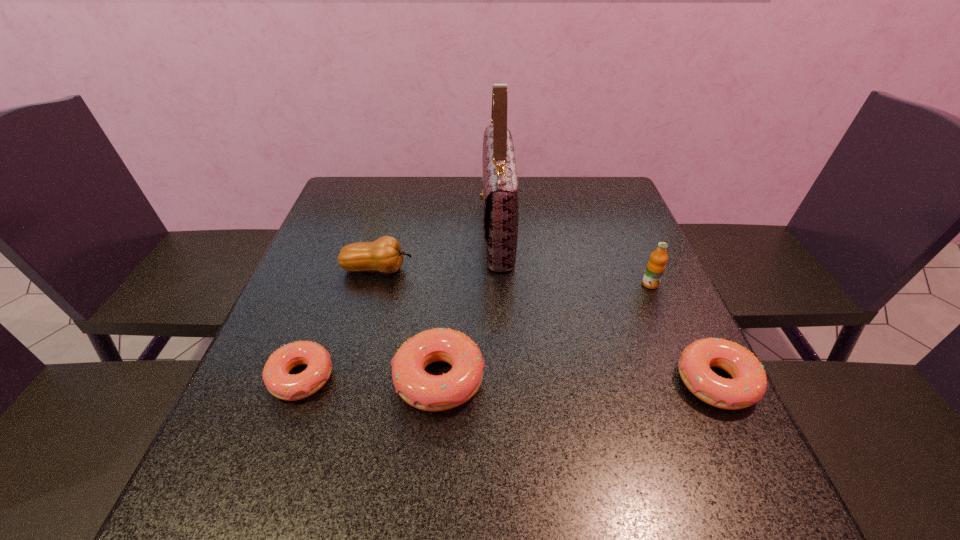
This screenshot has width=960, height=540. Find the location of `blank region between the third tallest object and the second doughnut from left to right`. blank region between the third tallest object and the second doughnut from left to right is located at coordinates (408, 324).

Where is `free spot between the tallest object and the second doughnut from right to left`? The image size is (960, 540). free spot between the tallest object and the second doughnut from right to left is located at coordinates (468, 305).

Locate an element on the screen. This screenshot has width=960, height=540. vacant area that lies between the handbag and the rightmost doughnut is located at coordinates (607, 306).

This screenshot has height=540, width=960. I want to click on free space between the third tallest object and the tallest object, so click(x=438, y=249).

At what (x,y) coordinates should I click in order to perform the action: click on free area in between the orange juice and the handbag. Please return your answer as a coordinate pair (x, y). Looking at the image, I should click on (574, 257).

You are a GUI agent. You are given a task and a screenshot of the screen. Output one action in this format:
    pyautogui.click(x=<x>, y=<y>)
    Task: Click on the vacant point located between the tallest object and the second doughnut from right to left
    
    Given the screenshot: What is the action you would take?
    pyautogui.click(x=468, y=305)

In order to click on vacant space that is in between the handbag and the leftmost doughnut in this screenshot , I will do `click(399, 304)`.

This screenshot has height=540, width=960. I want to click on object identified as the third closest to the handbag, so click(656, 265).

Locate which object is the closest to the handbag. Please provide its 2D coordinates. Your answer should be formatted as a tuple, i.e. [(x, y)], where the tuple contains the x and y coordinates of a point satisfying the conditions above.

[(385, 255)]

This screenshot has height=540, width=960. I want to click on the third closest doughnut relative to the handbag, so click(x=281, y=384).